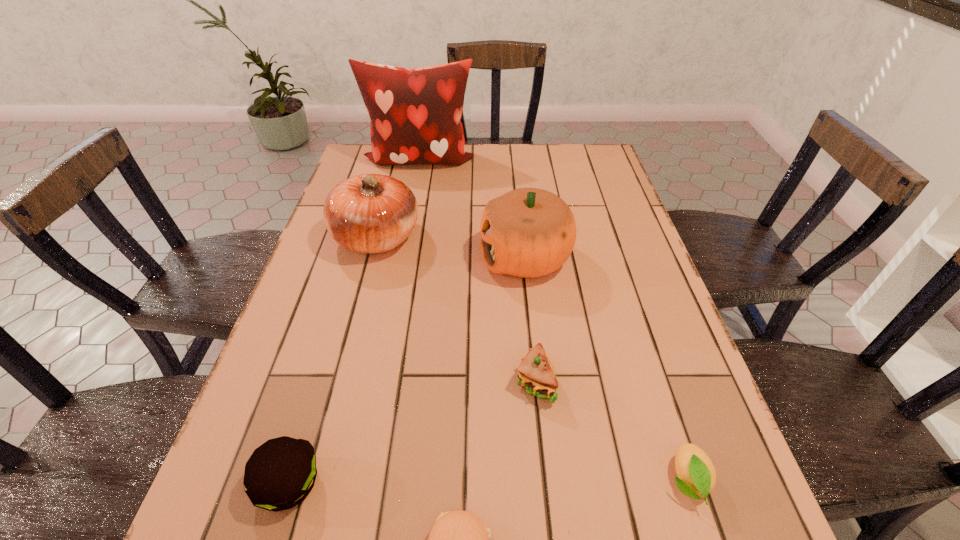
At what (x,y) coordinates should I click in order to perform the action: click on free area in between the sixth tallest object and the sandwich. Please return your answer as a coordinate pair (x, y). Looking at the image, I should click on (612, 431).

Where is `the second closest object relative to the tallest object`? the second closest object relative to the tallest object is located at coordinates (528, 232).

This screenshot has width=960, height=540. What are the coordinates of `object that stands as the fifth closest to the farthest object` in the screenshot? It's located at (696, 473).

The width and height of the screenshot is (960, 540). What are the coordinates of `free location that satisfies the following two spatial constraints: 1. on the face of the right pumpkin; 2. on the front side of the left patty` in the screenshot? It's located at (551, 484).